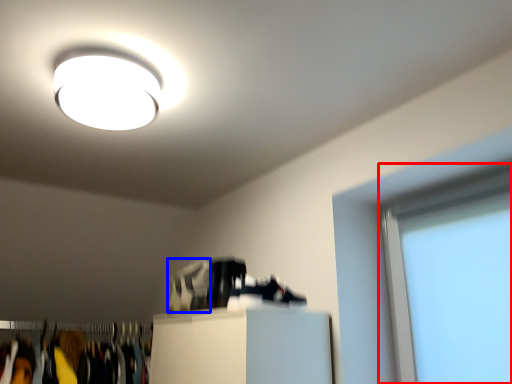
Question: Which object appears farthest to the camera in this image, window screen (highlighted by a red box) or shoe (highlighted by a blue box)?

Choices:
 (A) window screen
 (B) shoe

Answer: (B)